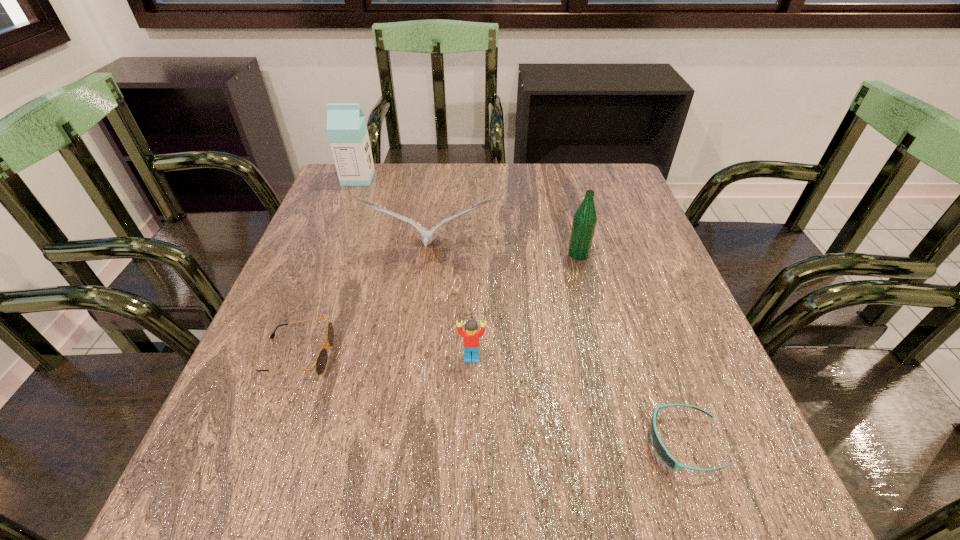
The image size is (960, 540). I want to click on sunglasses positioned at the left edge, so click(x=321, y=361).

I want to click on object at the right edge, so click(x=658, y=446).

This screenshot has height=540, width=960. What are the coordinates of `object located in the far left corner section of the desktop` in the screenshot? It's located at (347, 129).

Locate an element on the screen. Image resolution: width=960 pixels, height=540 pixels. object present at the near right corner is located at coordinates (658, 446).

Where is `free space at the far edge`? free space at the far edge is located at coordinates point(546,181).

This screenshot has height=540, width=960. What are the coordinates of `vacant space at the near edge of the desktop` in the screenshot? It's located at (540, 495).

The image size is (960, 540). I want to click on free space at the left edge of the desktop, so click(x=343, y=281).

Locate an element on the screen. The width and height of the screenshot is (960, 540). vacant area at the right edge of the desktop is located at coordinates (602, 280).

In the image, there is a desktop. Where is `vacant space at the far right corner`? vacant space at the far right corner is located at coordinates (597, 177).

I want to click on free space between the gull and the right sunglasses, so click(557, 348).